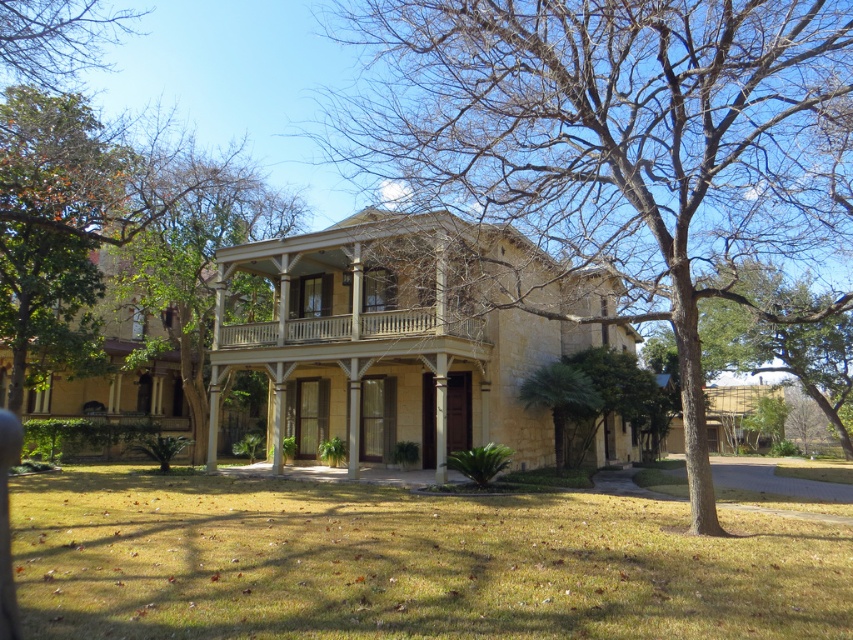
Question: Among these objects, which one is farthest from the camera?

Choices:
 (A) white wood porch at center
 (B) brown wood tree at upper left

Answer: (A)

Question: Which point is closer to the camera taking this photo?

Choices:
 (A) (409, 314)
 (B) (747, 332)
 (C) (602, 132)
 (D) (4, 29)

Answer: (C)

Question: Does green leafy tree at center come in front of brown wood tree at upper left?

Choices:
 (A) no
 (B) yes

Answer: (B)

Question: Can you confirm if brown wood tree at upper left is positioned to the left of white wood porch at center?

Choices:
 (A) yes
 (B) no

Answer: (A)

Question: Can you confirm if green leafy tree at center is smaller than brown wood tree at upper left?

Choices:
 (A) yes
 (B) no

Answer: (B)

Question: Which object is the closest to the green leafy tree at center?

Choices:
 (A) brown wood tree at upper left
 (B) white wood porch at center
 (C) brown bark tree at center

Answer: (C)